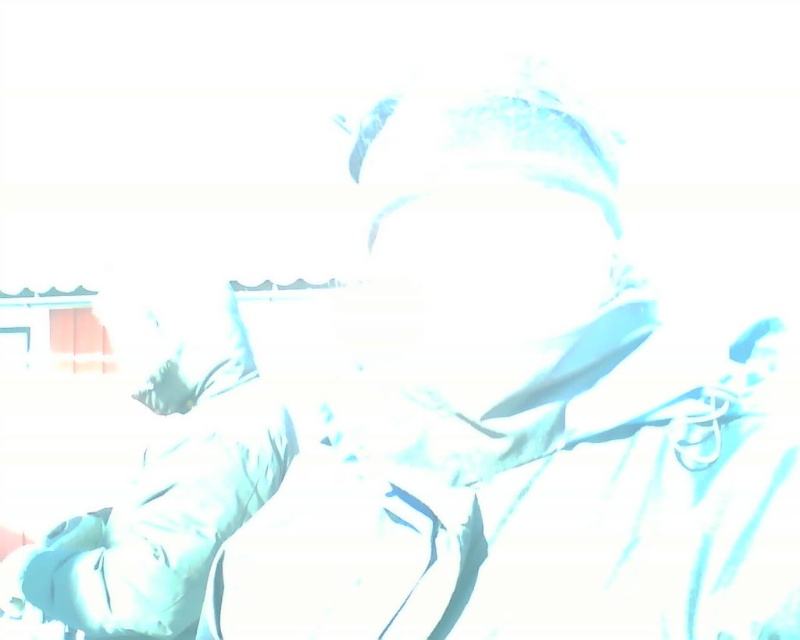
Question: Which of the following is the closest to the observer?

Choices:
 (A) (160, 572)
 (B) (492, 220)

Answer: (B)

Question: Does white fabric at center have a larger size compared to matte white shirt at lower left?

Choices:
 (A) yes
 (B) no

Answer: (B)

Question: Observing the image, what is the correct spatial positioning of white fabric at center in reference to matte white shirt at lower left?

Choices:
 (A) left
 (B) right

Answer: (B)

Question: Considering the relative positions of white fabric at center and matte white shirt at lower left in the image provided, where is white fabric at center located with respect to matte white shirt at lower left?

Choices:
 (A) below
 (B) above

Answer: (B)